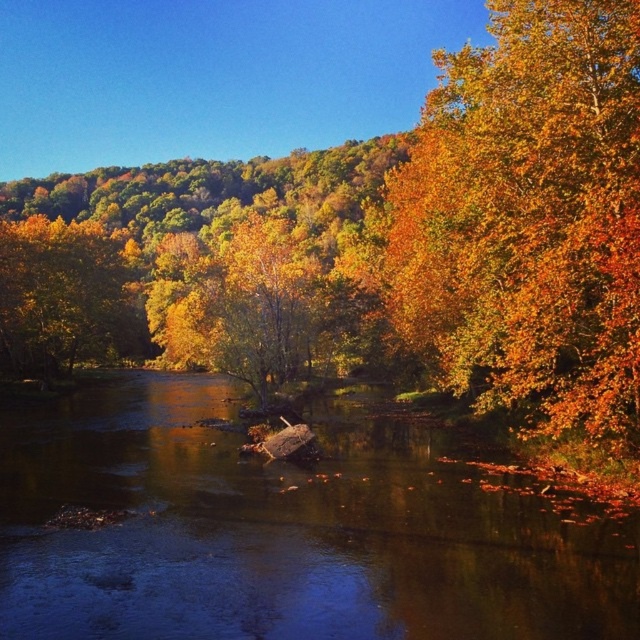
Looking at this image, you are standing at the edge of the river and want to cross it using the shallowest part. According to the image, where is the shiny brown water at center located?

The shiny brown water at center is located at point (284,532), which indicates its position in the image. To cross the river at the shallowest part, you should head towards that coordinate.